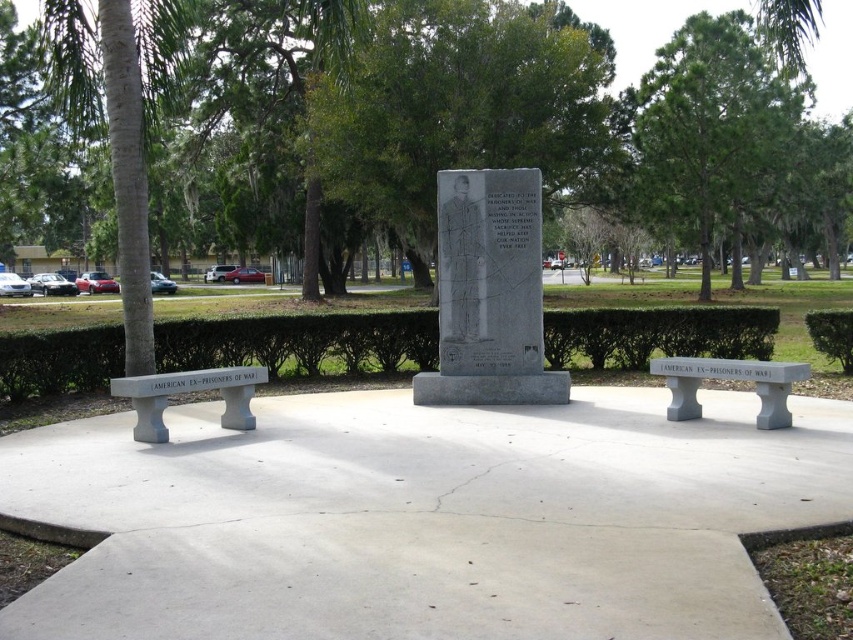
Measure the distance between gray concrete bench at center and gray stone monument at center.

gray concrete bench at center and gray stone monument at center are 17.67 feet apart.

Can you confirm if gray concrete bench at center is taller than gray stone monument at center?

Incorrect, gray concrete bench at center's height is not larger of gray stone monument at center's.

Which is in front, point (527, 604) or point (485, 209)?

Point (527, 604) is more forward.

Identify the location of gray concrete bench at center. This screenshot has height=640, width=853. (424, 518).

Is point (827, 84) positioned before point (233, 401)?

No, (827, 84) is further to viewer.

Is green leafy tree at center below gray concrete bench at left?

Actually, green leafy tree at center is above gray concrete bench at left.

Between point (821, 92) and point (186, 387), which one is positioned behind?

The point (821, 92) is behind.

The image size is (853, 640). Identify the location of green leafy tree at center. (646, 24).

Does gray stone monument at center have a larger size compared to green leafy tree at center?

No, gray stone monument at center is not bigger than green leafy tree at center.

Which is behind, point (497, 348) or point (677, 20)?

The point (677, 20) is more distant.

Does point (508, 221) come behind point (839, 8)?

No.

Locate an element on the screen. This screenshot has width=853, height=640. gray stone monument at center is located at coordinates (489, 292).